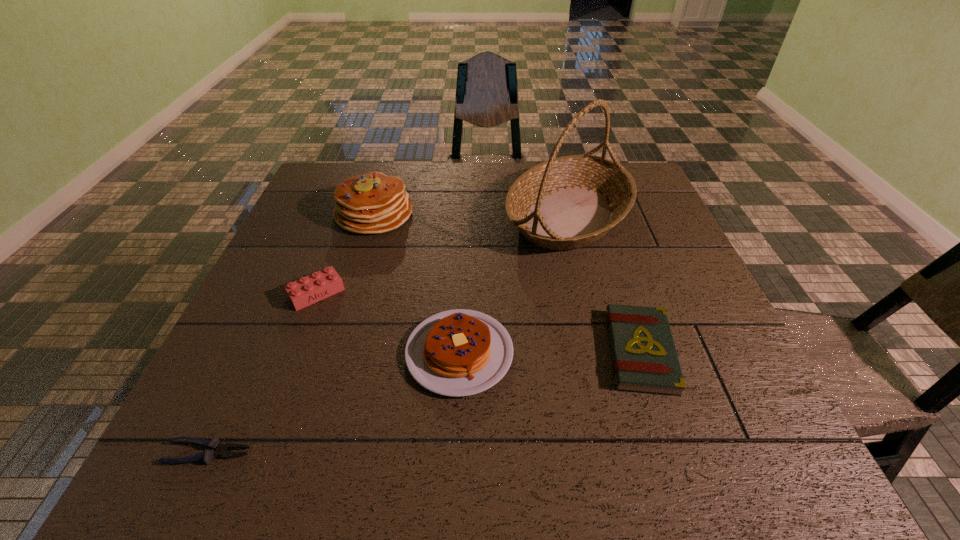
This screenshot has height=540, width=960. I want to click on vacant region at the far left corner, so click(x=314, y=181).

In the image, there is a desktop. Find the location of `free space at the near left corner`. free space at the near left corner is located at coordinates (223, 467).

Find the location of a particular element. The image size is (960, 540). vacant area that lies between the second shortest object and the right pancake is located at coordinates (549, 352).

Where is `free space between the second shortest object and the nearest object`? free space between the second shortest object and the nearest object is located at coordinates (424, 402).

What are the coordinates of `vacant area between the shortest object and the fifth tallest object` in the screenshot? It's located at (424, 402).

Locate an element on the screen. The image size is (960, 540). empty location between the shortest object and the fourth nearest object is located at coordinates (263, 373).

The height and width of the screenshot is (540, 960). Find the location of `vacant point located between the fifth tallest object and the shortest object`. vacant point located between the fifth tallest object and the shortest object is located at coordinates pos(424,402).

Locate an element on the screen. The width and height of the screenshot is (960, 540). free space between the fifth tallest object and the taller pancake is located at coordinates (507, 282).

Locate an element on the screen. The height and width of the screenshot is (540, 960). free spot between the taller pancake and the tallest object is located at coordinates (471, 214).

What are the coordinates of `free space that is in between the second shortest object and the right pancake` in the screenshot? It's located at (549, 352).